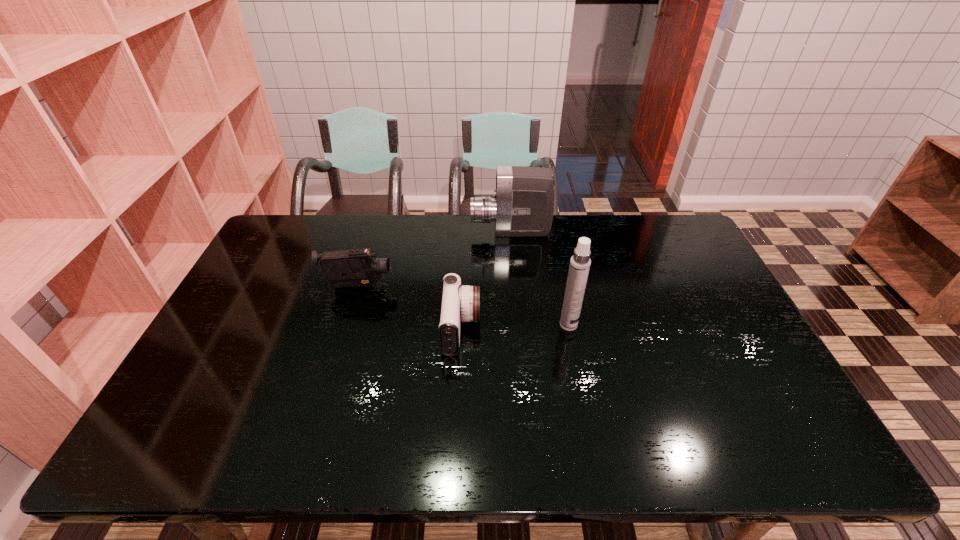
Identify the location of aerosol can. The height and width of the screenshot is (540, 960). (580, 262).

This screenshot has height=540, width=960. Find the location of `the farthest object`. the farthest object is located at coordinates (523, 205).

At what (x,y) coordinates should I click in order to perform the action: click on the farthest camcorder. Please return your answer as a coordinate pair (x, y). Looking at the image, I should click on (523, 205).

Find the location of a particular element. the second farthest object is located at coordinates (357, 267).

The image size is (960, 540). What are the coordinates of `the leftmost object` in the screenshot? It's located at (357, 267).

You are a GUI agent. You are given a task and a screenshot of the screen. Output one action in this format:
    pyautogui.click(x=<x>, y=<y>)
    Task: Click on the nearest camcorder
    
    Given the screenshot: What is the action you would take?
    pyautogui.click(x=459, y=303)

What are the coordinates of `free point located 0.340m on the back of the tallest object` in the screenshot? It's located at (553, 246).

This screenshot has width=960, height=540. What are the coordinates of `vacant area situated at the front of the tallest camcorder, highlighting the lens` in the screenshot? It's located at (457, 232).

The height and width of the screenshot is (540, 960). Identify the location of free spot located at the front of the tallest camcorder, highlighting the lens. (433, 232).

You are a GUI agent. You are given a task and a screenshot of the screen. Output one action in this format:
    pyautogui.click(x=<x>, y=<y>)
    Task: Click on the blank space located at the front of the tallest camcorder, highlighting the lens
    The width and height of the screenshot is (960, 540).
    Given the screenshot: What is the action you would take?
    pyautogui.click(x=399, y=232)